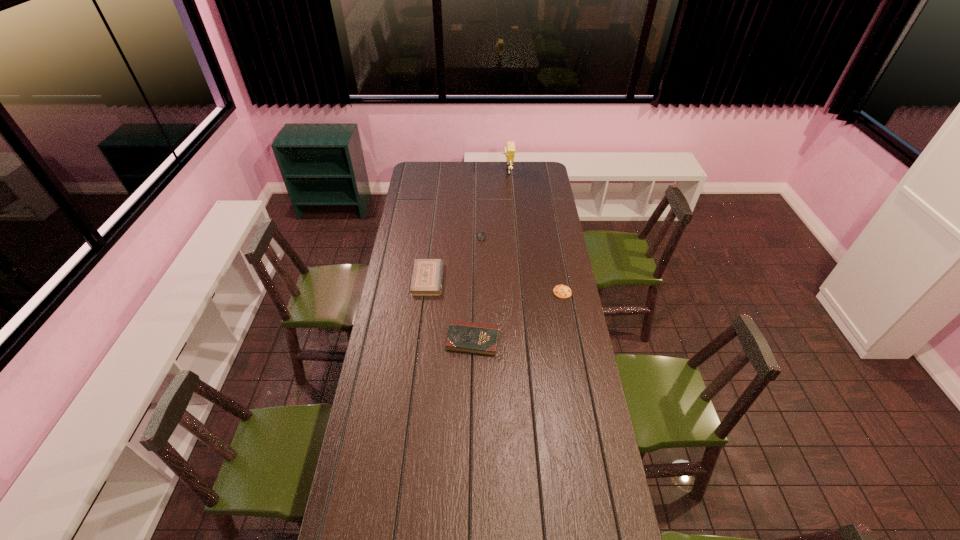
What are the coordinates of `vacant area that satisfies the following two spatial constraints: 1. on the spine side of the farther Bible; 2. on the left side of the right Bible` in the screenshot? It's located at [x=421, y=340].

At what (x,y) coordinates should I click in order to perform the action: click on free space that satisfies the following two spatial constraints: 1. on the back side of the shortest object; 2. on the face of the sponge. Please return your answer as a coordinate pair (x, y). Looking at the image, I should click on (540, 172).